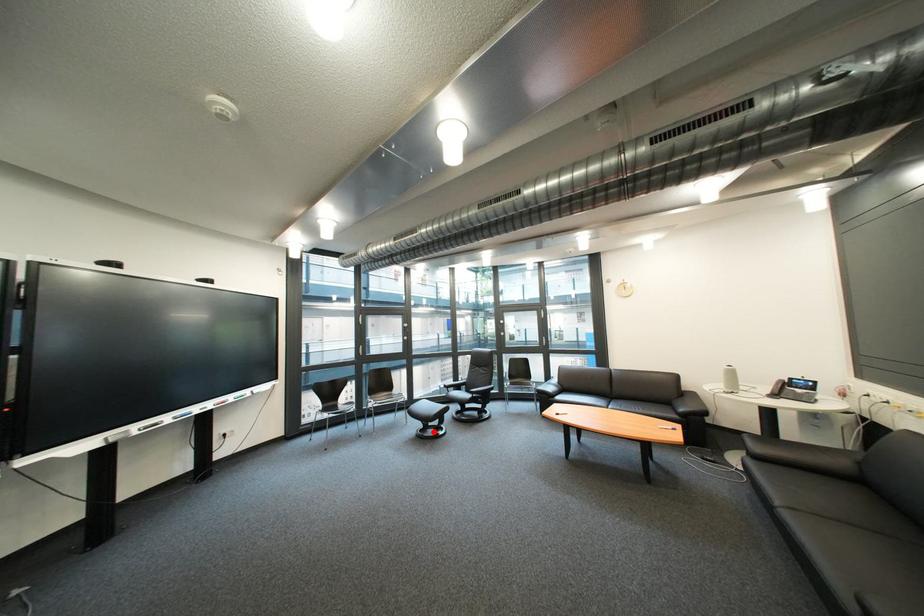
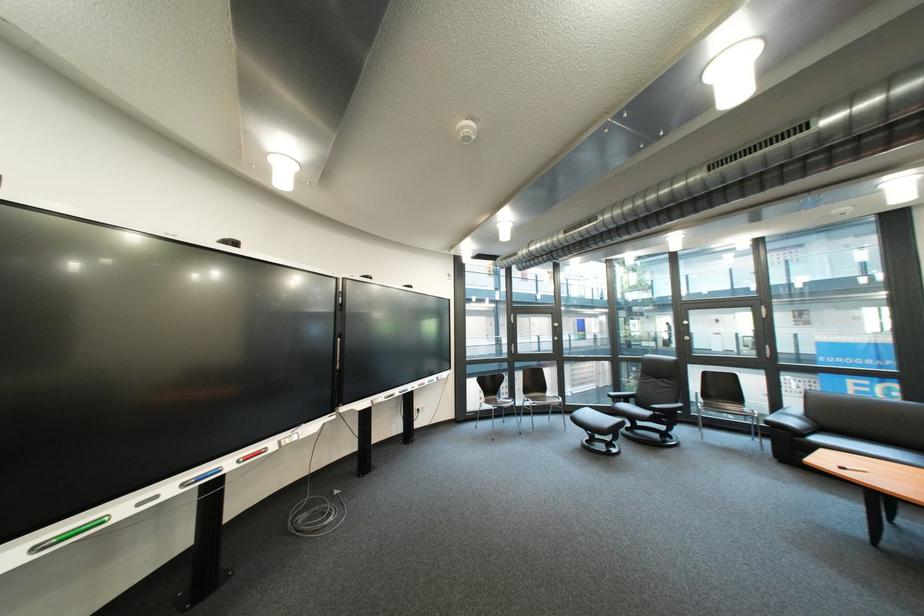
The point at the highlighted location is marked in the first image. Where is the corresponding point in the second image?

(601, 443)